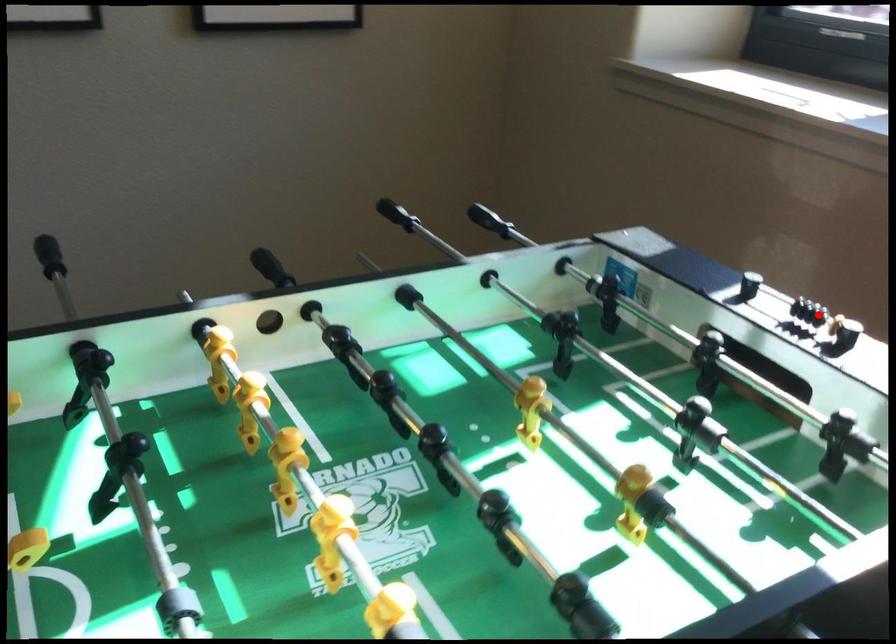
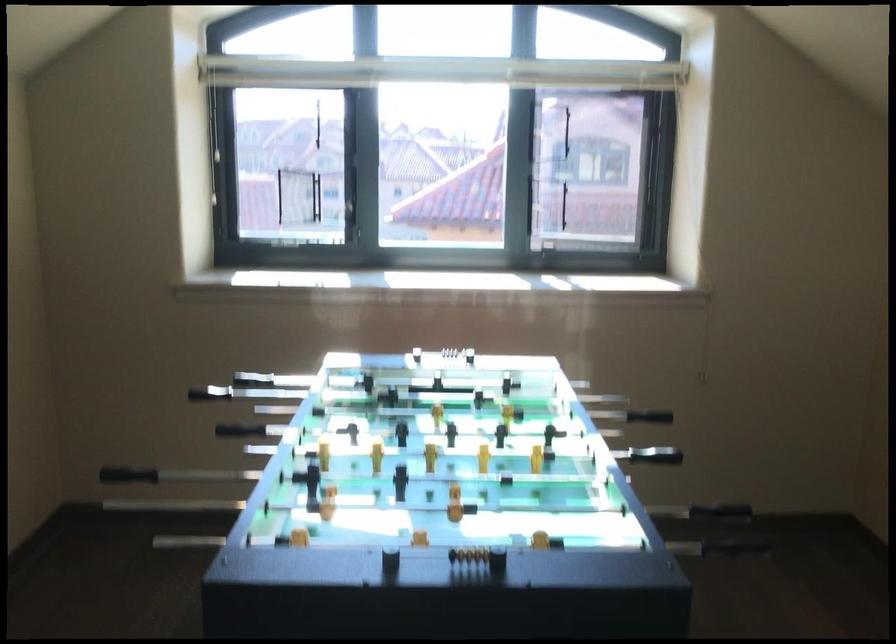
Question: I am providing you with two images of the same scene from different viewpoints. Given a red point in image1, look at the same physical point in image2. Is it:

Choices:
 (A) Closer to the viewpoint
 (B) Farther from the viewpoint

Answer: (B)